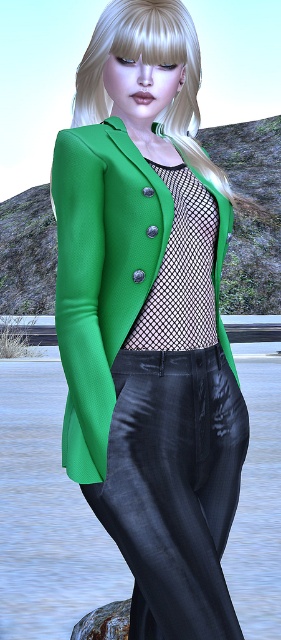
Question: Which point is farther to the camera?

Choices:
 (A) shiny black pants at center
 (B) green textured coat at center

Answer: (A)

Question: Among these points, which one is nearest to the camera?

Choices:
 (A) (116, 326)
 (B) (221, 609)

Answer: (B)

Question: Is shiny black pants at center to the right of green textured coat at center from the viewer's perspective?

Choices:
 (A) no
 (B) yes

Answer: (B)

Question: Does shiny black pants at center appear under green textured coat at center?

Choices:
 (A) yes
 (B) no

Answer: (A)

Question: Which object is farther from the camera taking this photo?

Choices:
 (A) shiny black pants at center
 (B) green textured coat at center

Answer: (A)

Question: Can you confirm if shiny black pants at center is positioned to the left of green textured coat at center?

Choices:
 (A) yes
 (B) no

Answer: (B)